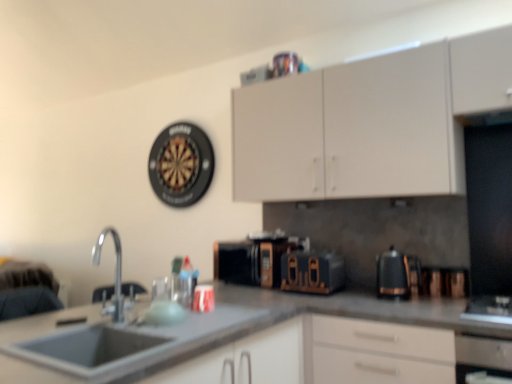
Question: Can we say silver metallic faucet at lower left lies outside white matte cabinet at upper center?

Choices:
 (A) no
 (B) yes

Answer: (B)

Question: Is silver metallic faucet at lower left to the left of white matte cabinet at upper center from the viewer's perspective?

Choices:
 (A) no
 (B) yes

Answer: (B)

Question: Is silver metallic faucet at lower left thinner than white matte cabinet at upper center?

Choices:
 (A) no
 (B) yes

Answer: (B)

Question: Can you confirm if silver metallic faucet at lower left is smaller than white matte cabinet at upper center?

Choices:
 (A) yes
 (B) no

Answer: (A)

Question: From the image's perspective, would you say silver metallic faucet at lower left is positioned over white matte cabinet at upper center?

Choices:
 (A) no
 (B) yes

Answer: (A)

Question: In terms of height, does smooth gray countertop at center look taller or shorter compared to silver metallic faucet at lower left?

Choices:
 (A) tall
 (B) short

Answer: (A)

Question: Would you say smooth gray countertop at center is to the left or to the right of silver metallic faucet at lower left in the picture?

Choices:
 (A) right
 (B) left

Answer: (A)

Question: Is smooth gray countertop at center inside or outside of silver metallic faucet at lower left?

Choices:
 (A) inside
 (B) outside

Answer: (B)

Question: Does point (31, 354) appear closer or farther from the camera than point (117, 264)?

Choices:
 (A) closer
 (B) farther

Answer: (A)

Question: Would you say gray matte sink at lower left is to the left or to the right of black metallic toaster at center, which appears as the first appliance when viewed from the right, in the picture?

Choices:
 (A) left
 (B) right

Answer: (A)

Question: Would you say gray matte sink at lower left is inside or outside black metallic toaster at center, the 2th appliance positioned from the left?

Choices:
 (A) inside
 (B) outside

Answer: (B)

Question: Is point (58, 359) positioned closer to the camera than point (318, 256)?

Choices:
 (A) farther
 (B) closer

Answer: (B)

Question: In the image, is gray matte sink at lower left positioned in front of or behind black metallic toaster at center, the 2th appliance positioned from the left?

Choices:
 (A) behind
 (B) front

Answer: (B)

Question: Considering their positions, is white matte cabinet at upper center located in front of or behind black plastic coffee pot at right?

Choices:
 (A) front
 (B) behind

Answer: (A)

Question: From a real-world perspective, is white matte cabinet at upper center physically located above or below black plastic coffee pot at right?

Choices:
 (A) below
 (B) above

Answer: (B)